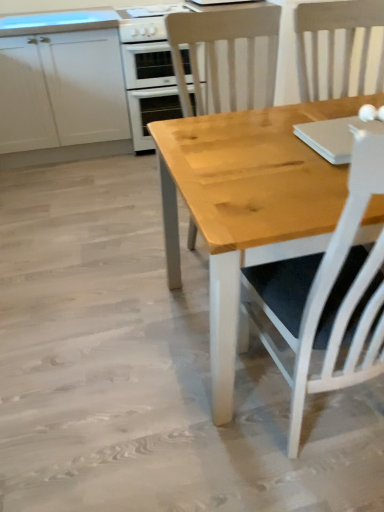
Where is `wooden chair at center`? This screenshot has height=512, width=384. wooden chair at center is located at coordinates (227, 52).

At what (x,y) coordinates should I click in order to perform the action: click on white matte cabinet at upper left. Please return your answer as a coordinate pair (x, y). This screenshot has height=512, width=384. Looking at the image, I should click on (61, 88).

Which is closer, [134,20] or [39,160]?

Point [134,20]

Looking at this image, do you think white glossy gas stove at upper center is within white matte cabinet at upper left, or outside of it?

white glossy gas stove at upper center is located beyond the bounds of white matte cabinet at upper left.

From a real-world perspective, is white glossy gas stove at upper center physically above white matte cabinet at upper left?

Yes, from a real-world perspective, white glossy gas stove at upper center is above white matte cabinet at upper left.

In terms of height, does white glossy oven at upper left look taller or shorter compared to white matte cabinet at upper left?

In the image, white glossy oven at upper left appears to be shorter than white matte cabinet at upper left.

The width and height of the screenshot is (384, 512). I want to click on cabinetry in front of the white glossy oven at upper left, so click(61, 88).

Consider the image. Which object is positioned more to the left, white glossy oven at upper left or white matte cabinet at upper left?

white matte cabinet at upper left.

Does wooden chair at center come behind white matte cabinet at upper left?

No, wooden chair at center is in front of white matte cabinet at upper left.

Consider the image. Is wooden chair at center taller than white matte cabinet at upper left?

Yes, wooden chair at center is taller than white matte cabinet at upper left.

Is point (271, 11) more distant than point (76, 79)?

No, it is not.

Which of these two, wooden chair at center or white glossy oven at upper left, is smaller?

white glossy oven at upper left.

From a real-world perspective, is wooden chair at center under white glossy oven at upper left?

No, from a real-world perspective, wooden chair at center is not beneath white glossy oven at upper left.

Which point is more distant from viewer, [204,25] or [150,94]?

The point [150,94] is farther.

Considering the sizes of objects wooden chair at center and white glossy oven at upper left in the image provided, who is shorter, wooden chair at center or white glossy oven at upper left?

Standing shorter between the two is white glossy oven at upper left.

Is white matte cabinet at upper left inside or outside of white glossy gas stove at upper center?

white matte cabinet at upper left is located beyond the bounds of white glossy gas stove at upper center.

Is white matte cabinet at upper left aimed at white glossy gas stove at upper center?

No, white matte cabinet at upper left is not aimed at white glossy gas stove at upper center.

From their relative heights in the image, would you say white matte cabinet at upper left is taller or shorter than white glossy gas stove at upper center?

In the image, white matte cabinet at upper left appears to be taller than white glossy gas stove at upper center.

From a real-world perspective, is white matte cabinet at upper left physically located above or below white glossy gas stove at upper center?

white matte cabinet at upper left is below white glossy gas stove at upper center.

Is white glossy gas stove at upper center directly adjacent to wooden chair at center?

white glossy gas stove at upper center and wooden chair at center are not in contact.

Looking at this image, who is bigger, white glossy gas stove at upper center or wooden chair at center?

wooden chair at center is bigger.

In the scene shown: Is white glossy gas stove at upper center at the left side of wooden chair at center?

Yes.

Is wooden chair at center at the back of white glossy gas stove at upper center?

No, white glossy gas stove at upper center is not facing away from wooden chair at center.

Considering the sizes of objects white glossy gas stove at upper center and white glossy oven at upper left in the image provided, who is taller, white glossy gas stove at upper center or white glossy oven at upper left?

Standing taller between the two is white glossy oven at upper left.

Which object is thinner, white glossy gas stove at upper center or white glossy oven at upper left?

With smaller width is white glossy gas stove at upper center.

I want to click on kitchen appliance behind the white glossy gas stove at upper center, so click(148, 70).

Between white glossy gas stove at upper center and white glossy oven at upper left, which one has larger size?

With larger size is white glossy oven at upper left.

Where is `gas stove located behind the white matte cabinet at upper left`? Image resolution: width=384 pixels, height=512 pixels. gas stove located behind the white matte cabinet at upper left is located at coordinates (146, 22).

Find the location of `kitchen appliance above the white matte cabinet at upper left (from the image's perspective)`. kitchen appliance above the white matte cabinet at upper left (from the image's perspective) is located at coordinates (148, 70).

Based on their spatial positions, is white glossy oven at upper left or wooden chair at center further from white glossy gas stove at upper center?

wooden chair at center is further to white glossy gas stove at upper center.

Estimate the real-world distances between objects in this image. Which object is closer to white glossy gas stove at upper center, wooden chair at center or white matte cabinet at upper left?

Among the two, wooden chair at center is located nearer to white glossy gas stove at upper center.

Looking at this image, from the image, which object appears to be nearer to wooden chair at center, white glossy gas stove at upper center or white matte cabinet at upper left?

white glossy gas stove at upper center lies closer to wooden chair at center than the other object.

Based on their spatial positions, is wooden chair at center or white glossy oven at upper left closer to white glossy gas stove at upper center?

white glossy oven at upper left lies closer to white glossy gas stove at upper center than the other object.

Considering their positions, is white glossy oven at upper left positioned further to white matte cabinet at upper left than wooden chair at center?

wooden chair at center lies further to white matte cabinet at upper left than the other object.

Considering their positions, is white matte cabinet at upper left positioned further to white glossy gas stove at upper center than wooden chair at center?

white matte cabinet at upper left.

Looking at the image, which one is located further to white matte cabinet at upper left, white glossy oven at upper left or white glossy gas stove at upper center?

white glossy gas stove at upper center is positioned further to the anchor white matte cabinet at upper left.

Looking at the image, which one is located further to white glossy oven at upper left, wooden chair at center or white matte cabinet at upper left?

The object further to white glossy oven at upper left is white matte cabinet at upper left.

Identify the location of cabinetry located between wooden chair at center and white glossy gas stove at upper center in the depth direction. The height and width of the screenshot is (512, 384). (61, 88).

Where is `kitchen appliance situated between white matte cabinet at upper left and white glossy gas stove at upper center from left to right`? The width and height of the screenshot is (384, 512). kitchen appliance situated between white matte cabinet at upper left and white glossy gas stove at upper center from left to right is located at coordinates (148, 70).

Image resolution: width=384 pixels, height=512 pixels. I want to click on cabinetry positioned between wooden chair at center and white glossy oven at upper left from near to far, so click(61, 88).

Find the location of a particular element. gas stove between wooden chair at center and white glossy oven at upper left in the front-back direction is located at coordinates (146, 22).